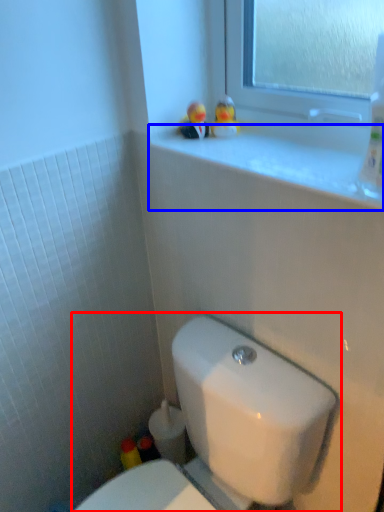
Question: Which object is closer to the camera taking this photo, toilet (highlighted by a red box) or window sill (highlighted by a blue box)?

Choices:
 (A) toilet
 (B) window sill

Answer: (A)